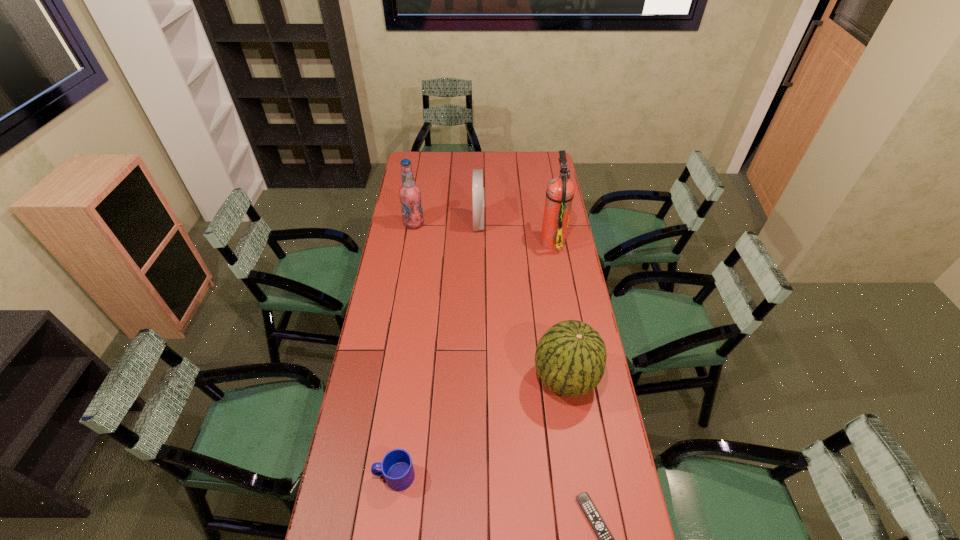
Find the location of `vacant region located on the front of the fourth farthest object`. vacant region located on the front of the fourth farthest object is located at coordinates (587, 518).

Locate an element on the screen. This screenshot has width=960, height=540. vacant region located on the front-facing side of the first-aid kit is located at coordinates (536, 222).

Find the location of a particular element. This screenshot has width=960, height=540. vacant space located 0.090m on the side with the handle of the fifth farthest object is located at coordinates [x=345, y=476].

Identify the location of vacant space located 0.110m on the side with the handle of the fifth farthest object. pyautogui.click(x=339, y=476).

You are a GUI agent. You are given a task and a screenshot of the screen. Output one action in this format:
    pyautogui.click(x=<x>, y=<y>)
    Task: Click on the vacant space located on the side with the handle of the fifth farthest object
    
    Given the screenshot: What is the action you would take?
    pyautogui.click(x=342, y=476)

You are a GUI agent. You are given a task and a screenshot of the screen. Output one action in this format:
    pyautogui.click(x=<x>, y=<y>)
    Task: Click on the alcohol located at the left edge
    
    Given the screenshot: What is the action you would take?
    pyautogui.click(x=410, y=195)

I want to click on mug at the left edge, so click(x=397, y=468).

I want to click on fire extinguisher at the right edge, so click(x=560, y=191).

Where is `watermelon that is positioned at the right edge`? This screenshot has height=540, width=960. watermelon that is positioned at the right edge is located at coordinates (570, 359).

In the image, there is a desktop. In order to click on vacant space at the far edge in this screenshot , I will do `click(519, 163)`.